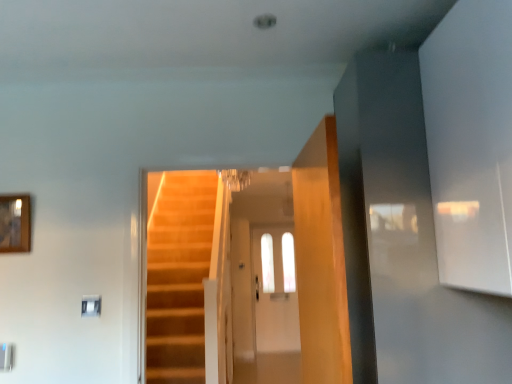
Question: Does wooden framed mirror at upper left lie behind clear glass door at center?

Choices:
 (A) yes
 (B) no

Answer: (B)

Question: Can you confirm if wooden framed mirror at upper left is smaller than clear glass door at center?

Choices:
 (A) no
 (B) yes

Answer: (B)

Question: Is wooden framed mirror at upper left touching clear glass door at center?

Choices:
 (A) no
 (B) yes

Answer: (A)

Question: Is wooden framed mirror at upper left positioned with its back to clear glass door at center?

Choices:
 (A) yes
 (B) no

Answer: (A)

Question: Is wooden framed mirror at upper left far from clear glass door at center?

Choices:
 (A) yes
 (B) no

Answer: (A)

Question: From the image's perspective, is wooden framed mirror at upper left beneath clear glass door at center?

Choices:
 (A) no
 (B) yes

Answer: (A)

Question: Can you confirm if clear glass door at center is thinner than wooden framed mirror at upper left?

Choices:
 (A) yes
 (B) no

Answer: (B)

Question: Is wooden framed mirror at upper left located within clear glass door at center?

Choices:
 (A) yes
 (B) no

Answer: (B)

Question: Can you confirm if clear glass door at center is positioned to the left of wooden framed mirror at upper left?

Choices:
 (A) yes
 (B) no

Answer: (B)

Question: From the image's perspective, is clear glass door at center under wooden framed mirror at upper left?

Choices:
 (A) yes
 (B) no

Answer: (A)

Question: Is clear glass door at center taller than wooden framed mirror at upper left?

Choices:
 (A) yes
 (B) no

Answer: (A)

Question: Does clear glass door at center have a larger size compared to wooden framed mirror at upper left?

Choices:
 (A) no
 (B) yes

Answer: (B)

Question: Is wooden framed mirror at upper left inside the boundaries of clear glass door at center, or outside?

Choices:
 (A) outside
 (B) inside

Answer: (A)